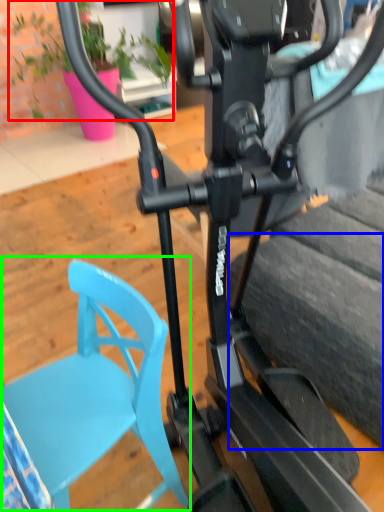
Question: Which is nearer to the plant (highlighted by a red box)? tire (highlighted by a blue box) or swivel chair (highlighted by a green box).

Choices:
 (A) tire
 (B) swivel chair

Answer: (A)